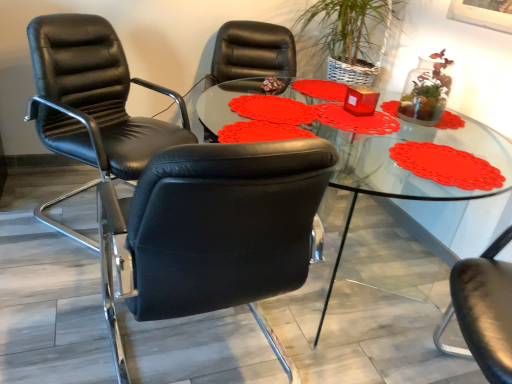
Where is `vacant area situated below transparent glass table at center (from a real-world perspective)`? The width and height of the screenshot is (512, 384). vacant area situated below transparent glass table at center (from a real-world perspective) is located at coordinates coord(355,291).